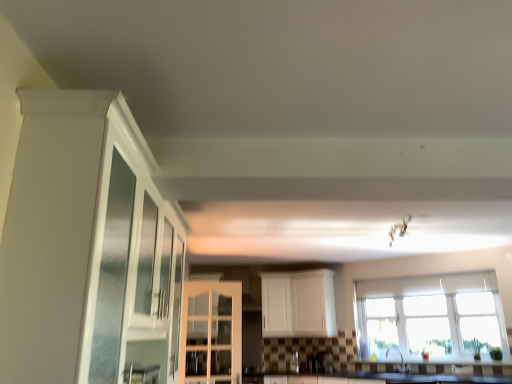
Question: From the image's perspective, is metallic glass bottle at center located above satin nickel faucet at lower center?

Choices:
 (A) yes
 (B) no

Answer: (B)

Question: Considering the relative sizes of metallic glass bottle at center and satin nickel faucet at lower center in the image provided, is metallic glass bottle at center bigger than satin nickel faucet at lower center?

Choices:
 (A) yes
 (B) no

Answer: (B)

Question: Can you confirm if metallic glass bottle at center is positioned to the right of satin nickel faucet at lower center?

Choices:
 (A) no
 (B) yes

Answer: (A)

Question: Considering the relative sizes of metallic glass bottle at center and satin nickel faucet at lower center in the image provided, is metallic glass bottle at center shorter than satin nickel faucet at lower center?

Choices:
 (A) yes
 (B) no

Answer: (A)

Question: Is metallic glass bottle at center surrounding satin nickel faucet at lower center?

Choices:
 (A) no
 (B) yes

Answer: (A)

Question: In terms of width, does white glossy cabinet at left, acting as the third cabinetry starting from the back, look wider or thinner when compared to clear glass window at center?

Choices:
 (A) wide
 (B) thin

Answer: (A)

Question: Is white glossy cabinet at left, acting as the third cabinetry starting from the back, in front of or behind clear glass window at center in the image?

Choices:
 (A) front
 (B) behind

Answer: (A)

Question: From their relative heights in the image, would you say white glossy cabinet at left, acting as the third cabinetry starting from the back, is taller or shorter than clear glass window at center?

Choices:
 (A) tall
 (B) short

Answer: (A)

Question: Based on their sizes in the image, would you say white glossy cabinet at left, positioned as the 1th cabinetry in front-to-back order, is bigger or smaller than clear glass window at center?

Choices:
 (A) big
 (B) small

Answer: (A)

Question: Based on their sizes in the image, would you say white glossy cabinet at center, marked as the second cabinetry in a front-to-back arrangement, is bigger or smaller than white glossy cabinet at left, positioned as the 1th cabinetry in front-to-back order?

Choices:
 (A) small
 (B) big

Answer: (A)

Question: From a real-world perspective, is white glossy cabinet at center, the second cabinetry in the back-to-front sequence, physically located above or below white glossy cabinet at left, acting as the third cabinetry starting from the back?

Choices:
 (A) above
 (B) below

Answer: (B)

Question: Visually, is white glossy cabinet at center, the second cabinetry in the back-to-front sequence, positioned to the left or to the right of white glossy cabinet at left, acting as the third cabinetry starting from the back?

Choices:
 (A) right
 (B) left

Answer: (A)

Question: Is point (226, 307) positioned closer to the camera than point (96, 152)?

Choices:
 (A) closer
 (B) farther

Answer: (B)

Question: In terms of size, does satin nickel faucet at lower center appear bigger or smaller than clear glass window at center?

Choices:
 (A) small
 (B) big

Answer: (A)

Question: From a real-world perspective, is satin nickel faucet at lower center positioned above or below clear glass window at center?

Choices:
 (A) below
 (B) above

Answer: (A)